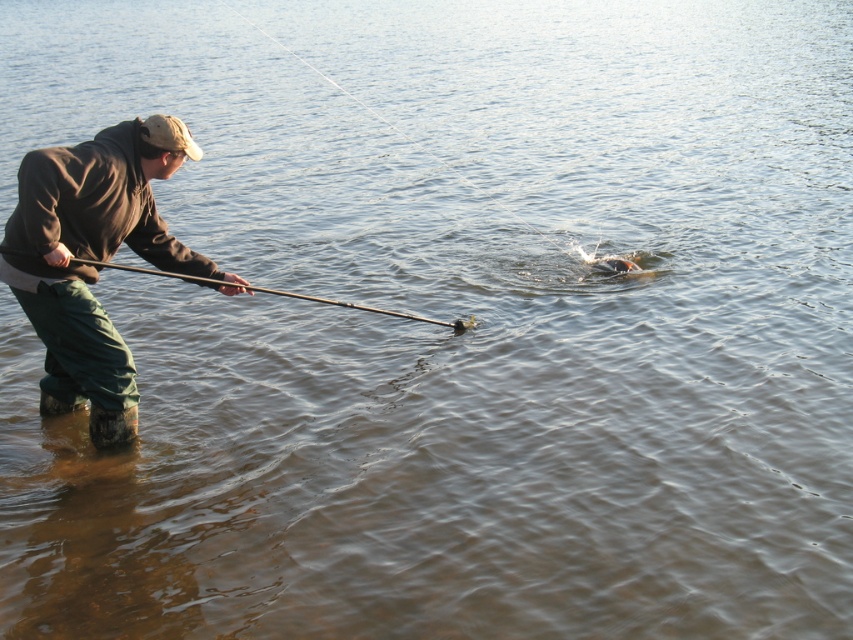
In the scene shown: You are standing on the shore observing the brown fabric jacket at left and the smooth black rod at center. Which object is nearer to you?

The brown fabric jacket at left is closer to the viewer than the smooth black rod at center.

You are a photographer trying to capture the fisherman and the rod in a single frame. Given the positions of the brown fabric jacket at left and the smooth black rod at center, which object should you focus on first to ensure both are in the frame?

The brown fabric jacket at left is taller than the smooth black rod at center, so focusing on the brown fabric jacket at left first will help ensure both objects are within the frame since it occupies a larger vertical space.